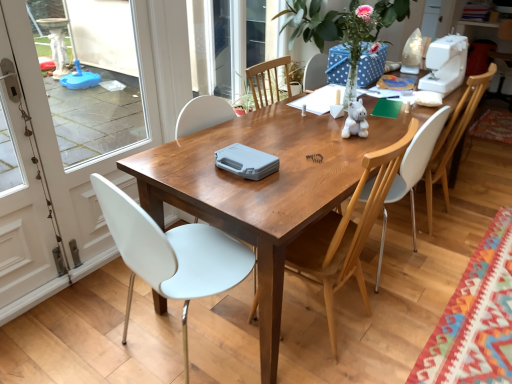
Question: In the image, is white plastic sewing machine at upper right positioned in front of or behind white glossy screen door at left, which ranks as the 1th screen door in left-to-right order?

Choices:
 (A) behind
 (B) front

Answer: (A)

Question: Does point click(x=461, y=44) appear closer or farther from the camera than point click(x=15, y=1)?

Choices:
 (A) farther
 (B) closer

Answer: (A)

Question: Which object is the farthest from the wooden table at center?

Choices:
 (A) white plush toy at center
 (B) white plastic chair at left, which appears as the 4th chair when viewed from the right
 (C) multicolored woven mat at lower right
 (D) white glossy screen door at left, which ranks as the first screen door in right-to-left order
 (E) white plastic chair at center, marked as the second chair in a right-to-left arrangement

Answer: (D)

Question: Estimate the real-world distances between objects in this image. Which object is closer to the white plastic chair at right, which appears as the first chair when viewed from the right?

Choices:
 (A) white glossy screen door at left, which ranks as the second screen door in right-to-left order
 (B) white plastic chair at center, marked as the second chair in a right-to-left arrangement
 (C) multicolored woven mat at lower right
 (D) white glossy screen door at left, which ranks as the first screen door in right-to-left order
 (E) white plastic chair at left, acting as the 1th chair starting from the left

Answer: (B)